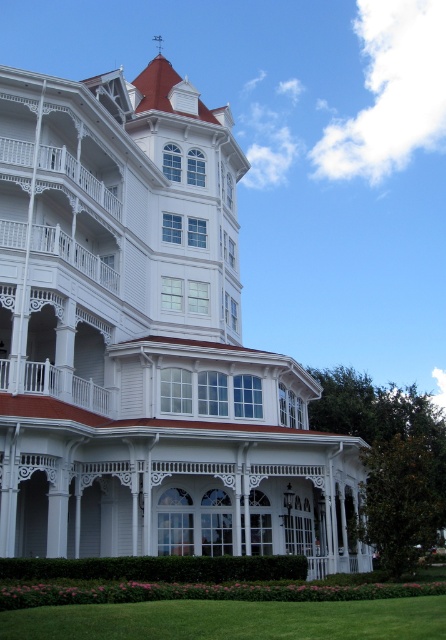
Identify the location of green grass at lower center. (231, 620).

Is white wood mansion at center positioned at the back of green grass at lower center?

That is True.

You are a GUI agent. You are given a task and a screenshot of the screen. Output one action in this format:
    pyautogui.click(x=<x>, y=<y>)
    Task: Click on the white wood mansion at center
    This screenshot has width=446, height=640.
    Given the screenshot: What is the action you would take?
    pyautogui.click(x=148, y=340)

Locate an element on the screen. white wood mansion at center is located at coordinates (148, 340).

Does white wood mansion at center appear over white painted wood porch at left?

Indeed, white wood mansion at center is positioned over white painted wood porch at left.

Locate an element on the screen. white wood mansion at center is located at coordinates (148, 340).